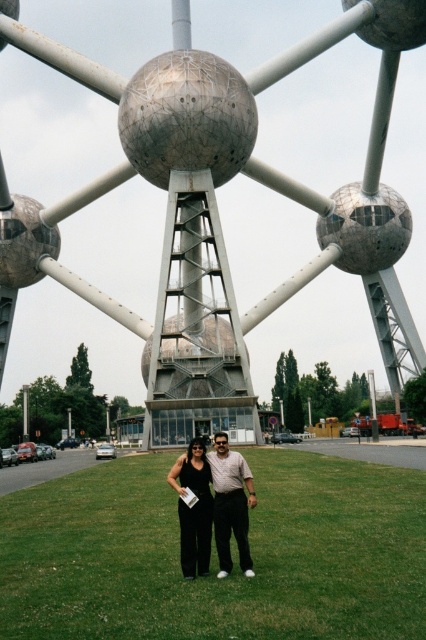
You are a photographer planning to capture a photo of the Atomium with the black fabric couple at center and the black satin dress at center. Based on their positions, which object is closer to the camera?

The black fabric couple at center is closer to the camera because it is positioned below the black satin dress at center, indicating it is in front of the dress.

You are a photographer planning to take a photo of the Atomium structure. You want to ensure the black fabric couple at center is positioned such that they are not blocking the view of the central sphere. Based on their current position at point (219, 497), can you determine if they are in a good spot for this?

The black fabric couple at center is positioned at point (219, 497). Since the central sphere of the Atomium is the largest and centrally located, their position at this coordinate likely places them in front of the central sphere, potentially blocking the view. To ensure the central sphere is visible, they should move slightly to the side or adjust their position.

You are a photographer planning to capture a photo of the Atomium with the green grass at center and the black fabric couple at center in the foreground. To ensure the couple is clearly visible against the structure, which object should be placed closer to the camera?

The black fabric couple at center should be placed closer to the camera since the green grass at center is shorter than the black fabric couple at center, ensuring the couple remains visible in the foreground.